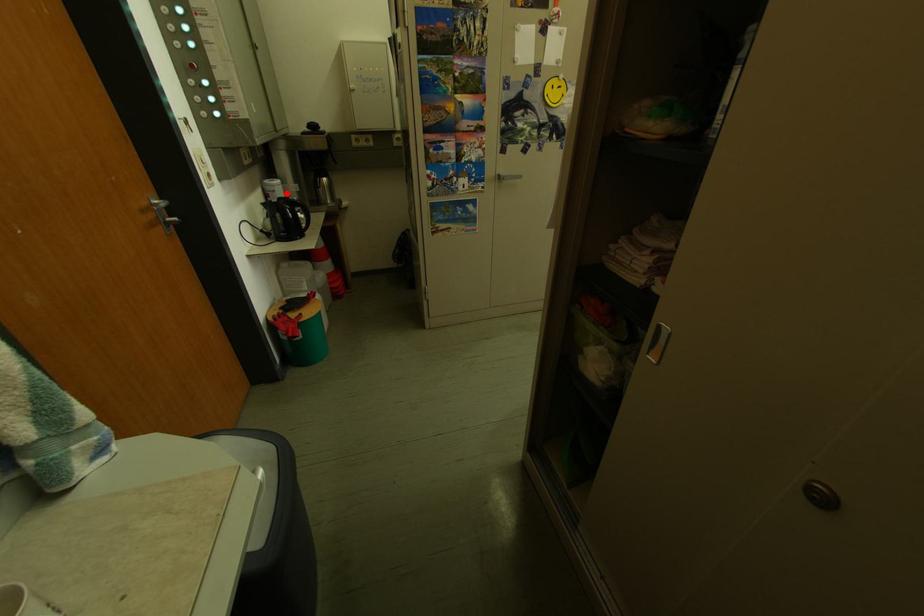
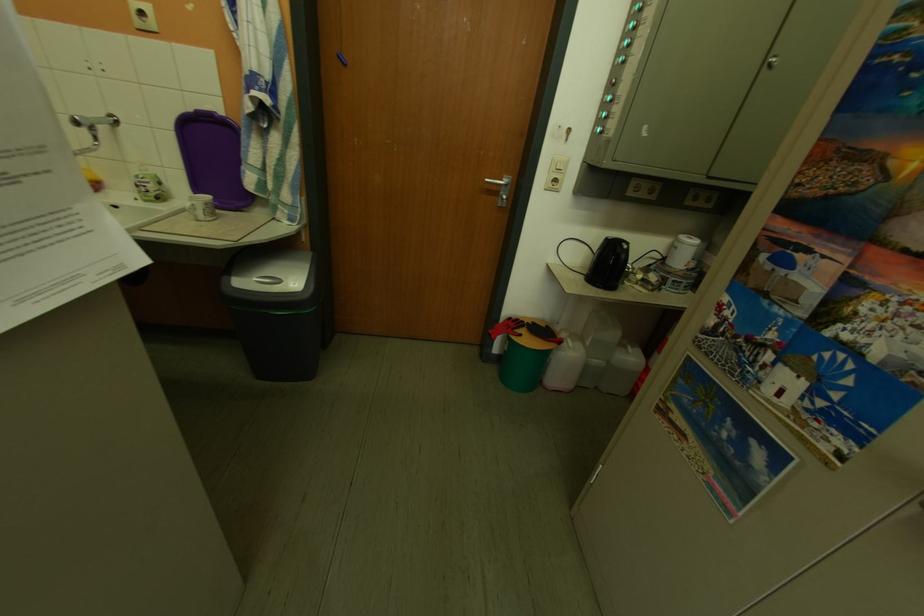
Find the pixel in the second image that matches the highlighted location in the first image.

(689, 251)